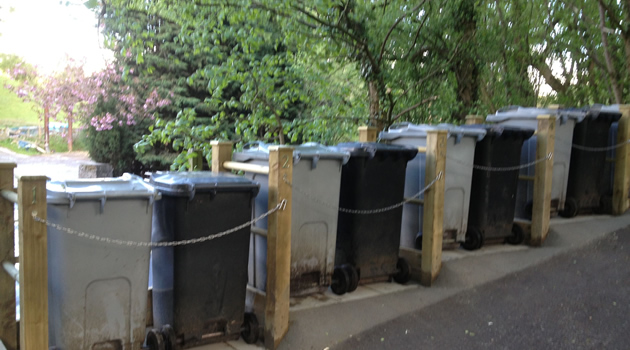
This screenshot has height=350, width=630. I want to click on wooden beams, so click(26, 306), click(276, 263), click(432, 217), click(541, 190), click(622, 172).